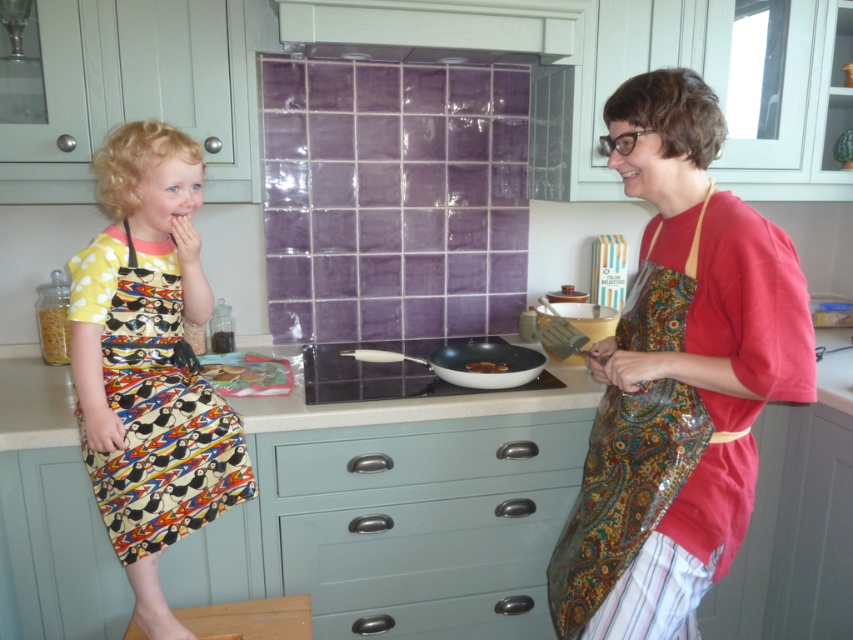
Can you confirm if printed fabric dress at left is positioned above matte light blue drawer at center?

Yes.

Is point (227, 420) farther from camera compared to point (283, 572)?

No, it is not.

Image resolution: width=853 pixels, height=640 pixels. I want to click on printed fabric dress at left, so click(x=160, y=417).

Between matte light blue drawer at center and white non-stick frying pan at center, which one is positioned lower?

matte light blue drawer at center

Between point (315, 596) and point (514, 368), which one is positioned in front?

Point (315, 596)

Does point (375, 580) come behind point (524, 372)?

No, (375, 580) is in front of (524, 372).

Locate an element on the screen. This screenshot has height=640, width=853. matte light blue drawer at center is located at coordinates (421, 548).

Who is more distant from viewer, (592, 387) or (498, 628)?

The point (498, 628) is more distant.

Find the location of a particular element. The height and width of the screenshot is (640, 853). smooth white countertop at center is located at coordinates (415, 404).